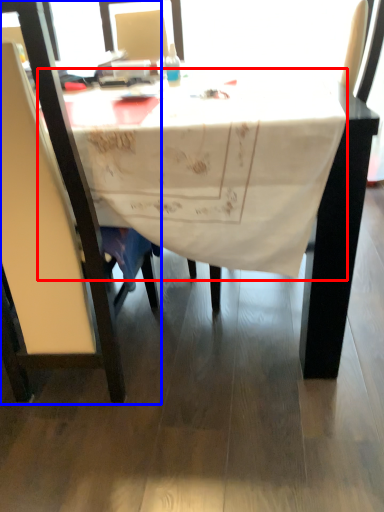
Question: Among these objects, which one is nearest to the camera, tablecloth (highlighted by a red box) or chair (highlighted by a blue box)?

Choices:
 (A) tablecloth
 (B) chair

Answer: (B)